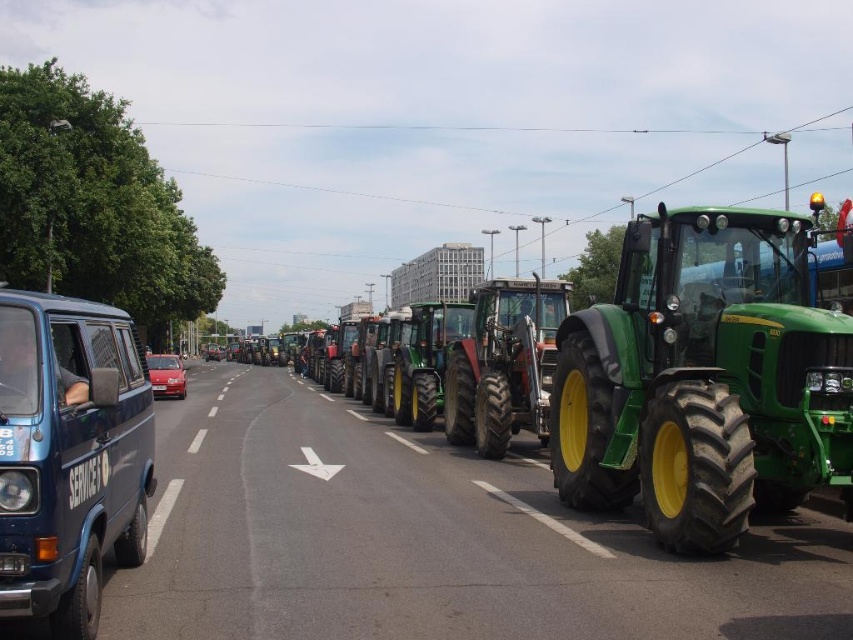
You are a drone operator tasked with capturing aerial footage of the protest. You need to fly your drone from the starting point at point [0,577] to the endpoint at point [479,481]. Considering the tractors are densely packed, which point should you prioritize keeping the drone closer to for a safer flight path?

You should prioritize keeping the drone closer to point [0,577] because it is closer to the viewer than point [479,481], providing a safer flight path with better visibility and control.